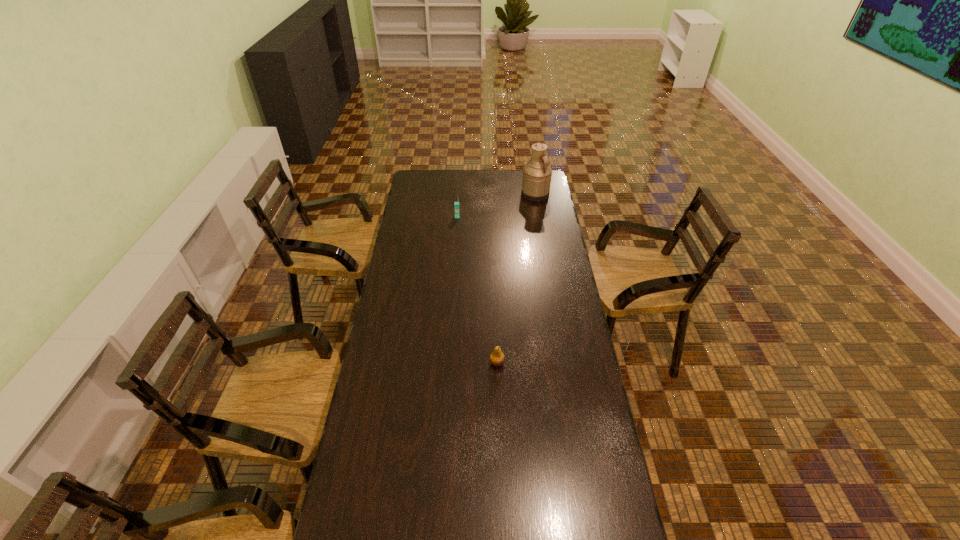
The image size is (960, 540). I want to click on pitcher, so click(537, 173).

Where is `the rightmost object`? The height and width of the screenshot is (540, 960). the rightmost object is located at coordinates (537, 173).

Identify the location of the leftmost object. This screenshot has height=540, width=960. (456, 204).

In order to click on the second farthest object in this screenshot , I will do `click(456, 204)`.

Find the location of a particular element. This screenshot has height=540, width=960. pear is located at coordinates (497, 358).

Locate an element on the screen. Image resolution: width=960 pixels, height=540 pixels. the nearest object is located at coordinates (497, 358).

Identify the location of vacant area situated 0.130m on the front of the pitcher. (539, 216).

Find the location of a particular element. This screenshot has width=960, height=540. free space located 0.290m on the keypad of the leftmost object is located at coordinates (455, 254).

Identify the location of vacant region located on the right of the pear. (537, 362).

I want to click on object that is at the far edge, so click(537, 173).